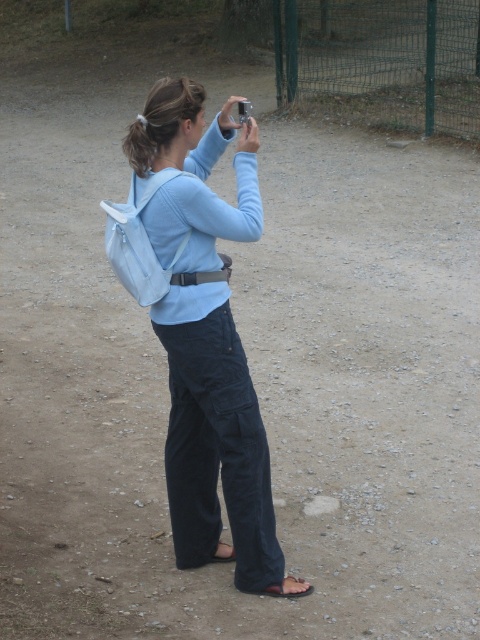
You are a photographer trying to capture the green wire mesh fence at upper right in your photo. However, the light blue fabric backpack at center is blocking your view. Can you adjust your position so that the backpack is no longer in front of the fence?

The light blue fabric backpack at center is much taller than the green wire mesh fence at upper right. Since the backpack is taller, moving closer to the fence might still allow you to frame the shot so the backpack is not blocking the view.

You are a photographer trying to capture a wide landscape shot. You have a light blue fabric backpack at center and a green wire mesh fence at upper right in your viewfinder. Which object should you adjust your camera angle to exclude if you want to focus on the fence?

You should exclude the light blue fabric backpack at center because it might be wider than the green wire mesh fence at upper right and could obstruct the view of the fence.

You are a photographer trying to capture the scene in front of you. You notice the light blue fabric backpack at center and the green wire mesh fence at upper right. Which object should you adjust your camera angle to include first if you want to frame both in your shot?

The light blue fabric backpack at center is to the left of the green wire mesh fence at upper right. To include both in your shot, you should first adjust your camera angle to the left to capture the backpack before centering the fence.